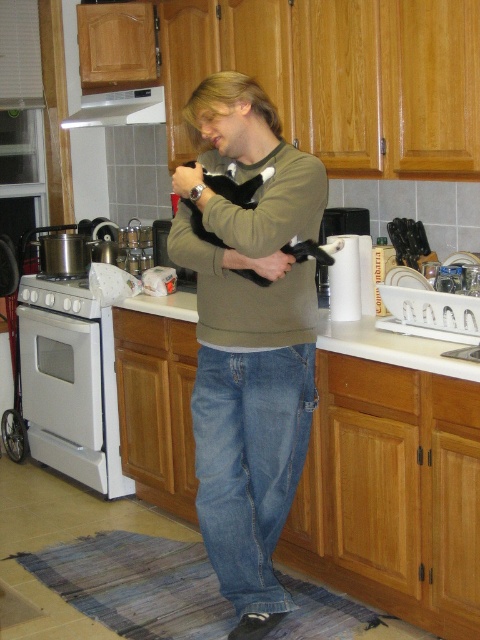
You are in the kitchen and want to place a small plant between the two points marked as point (x=227, y=145) and point (x=227, y=179). Which point should the plant be closer to so it is positioned in front of the other point?

The plant should be closer to point (x=227, y=179) because point (x=227, y=145) is behind point (x=227, y=179), so placing the plant near the front point would ensure it is in front of the other point.

You are a tailor who needs to determine if the soft green sweater at center can fit over the black fur cat at center. Can you confirm if the sweater is large enough to cover the cat?

The soft green sweater at center has a larger size compared to black fur cat at center, so yes, the sweater can cover the cat.

You are a delivery person who needs to place a small package on the countertop without disturbing the items there. Considering the soft green sweater at center and the black fur cat at center, which item should you avoid placing the package near to ensure it doesn

The soft green sweater at center is taller than the black fur cat at center, so placing the package near the soft green sweater at center might cause it to be knocked over, making it the item to avoid.